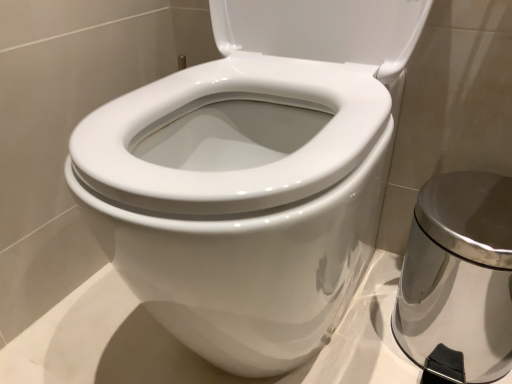
Describe the element at coordinates (240, 200) in the screenshot. I see `white glossy bidet at center` at that location.

Identify the location of white glossy bidet at center. (240, 200).

What is the approximate height of white glossy bidet at center?

white glossy bidet at center is 23.26 inches tall.

Measure the distance between point (432,178) and camera.

The depth of point (432,178) is 79.90 centimeters.

Find the location of `satin silver trash can at right`. satin silver trash can at right is located at coordinates (459, 274).

Measure the distance between satin silver trash can at right and camera.

satin silver trash can at right is 21.77 inches from camera.

What do you see at coordinates (459, 274) in the screenshot?
I see `satin silver trash can at right` at bounding box center [459, 274].

The image size is (512, 384). In order to click on white glossy bidet at center in this screenshot , I will do `click(240, 200)`.

Is satin silver trash can at right at the right side of white glossy bidet at center?

Yes, satin silver trash can at right is to the right of white glossy bidet at center.

Is satin silver trash can at right further to the viewer compared to white glossy bidet at center?

Yes, it is.

Does point (473, 378) appear closer or farther from the camera than point (292, 238)?

Point (473, 378) is farther from the camera than point (292, 238).

From the image's perspective, is satin silver trash can at right below white glossy bidet at center?

Yes, from the image's perspective, satin silver trash can at right is beneath white glossy bidet at center.

From a real-world perspective, is satin silver trash can at right physically located above or below white glossy bidet at center?

In terms of real-world spatial position, satin silver trash can at right is below white glossy bidet at center.

Considering the sizes of objects satin silver trash can at right and white glossy bidet at center in the image provided, who is wider, satin silver trash can at right or white glossy bidet at center?

Wider between the two is white glossy bidet at center.

Which of these two, satin silver trash can at right or white glossy bidet at center, stands taller?

Standing taller between the two is white glossy bidet at center.

Does satin silver trash can at right have a smaller size compared to white glossy bidet at center?

Yes, satin silver trash can at right is smaller than white glossy bidet at center.

Is satin silver trash can at right located outside white glossy bidet at center?

satin silver trash can at right lies outside white glossy bidet at center's area.

Are satin silver trash can at right and white glossy bidet at center beside each other?

No, satin silver trash can at right is not in contact with white glossy bidet at center.

Looking at this image, is satin silver trash can at right facing away from white glossy bidet at center?

No, satin silver trash can at right's orientation is not away from white glossy bidet at center.

How distant is satin silver trash can at right from white glossy bidet at center?

satin silver trash can at right is 10.12 inches away from white glossy bidet at center.

Find the location of a particular element. This screenshot has width=512, height=384. porcelain located underneath the white glossy bidet at center (from a real-world perspective) is located at coordinates [459, 274].

Considering the relative positions of white glossy bidet at center and satin silver trash can at right in the image provided, is white glossy bidet at center to the left of satin silver trash can at right from the viewer's perspective?

Indeed, white glossy bidet at center is positioned on the left side of satin silver trash can at right.

Which is behind, white glossy bidet at center or satin silver trash can at right?

satin silver trash can at right is more distant.

Is point (367, 122) farther from camera compared to point (496, 370)?

No, (367, 122) is closer to viewer.

From the image's perspective, is white glossy bidet at center positioned above or below satin silver trash can at right?

white glossy bidet at center is situated higher than satin silver trash can at right in the image.

From a real-world perspective, is white glossy bidet at center beneath satin silver trash can at right?

No, from a real-world perspective, white glossy bidet at center is not beneath satin silver trash can at right.

Which object is thinner, white glossy bidet at center or satin silver trash can at right?

satin silver trash can at right.

Is white glossy bidet at center taller or shorter than satin silver trash can at right?

Clearly, white glossy bidet at center is taller compared to satin silver trash can at right.

Does white glossy bidet at center have a smaller size compared to satin silver trash can at right?

Incorrect, white glossy bidet at center is not smaller in size than satin silver trash can at right.

Would you say white glossy bidet at center contains satin silver trash can at right?

No, white glossy bidet at center does not contain satin silver trash can at right.

Is white glossy bidet at center not near satin silver trash can at right?

That's not correct — white glossy bidet at center is a little close to satin silver trash can at right.

Is white glossy bidet at center oriented towards satin silver trash can at right?

No, white glossy bidet at center is not aimed at satin silver trash can at right.

Looking at this image, can you tell me how much white glossy bidet at center and satin silver trash can at right differ in facing direction?

The angular difference between white glossy bidet at center and satin silver trash can at right is 1.53 degrees.

Locate an element on the screen. This screenshot has height=384, width=512. bidet that is above the satin silver trash can at right (from the image's perspective) is located at coordinates (240, 200).

This screenshot has height=384, width=512. What are the coordinates of `porcelain lying behind the white glossy bidet at center` in the screenshot? It's located at click(459, 274).

Locate an element on the screen. porcelain on the right of the white glossy bidet at center is located at coordinates (459, 274).